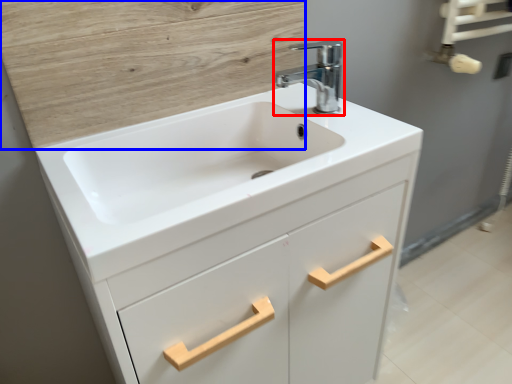
Question: Which object appears closest to the camera in this image, tap (highlighted by a red box) or plywood (highlighted by a blue box)?

Choices:
 (A) tap
 (B) plywood

Answer: (B)